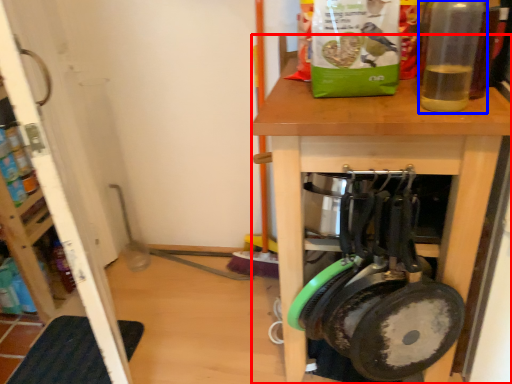
Question: Which of the following is the closest to the observer, desk (highlighted by a red box) or bottle (highlighted by a blue box)?

Choices:
 (A) desk
 (B) bottle

Answer: (B)